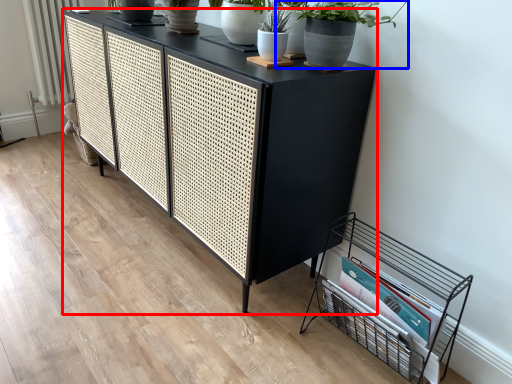
Question: Which object appears closest to the camera in this image, table (highlighted by a red box) or houseplant (highlighted by a blue box)?

Choices:
 (A) table
 (B) houseplant

Answer: (B)